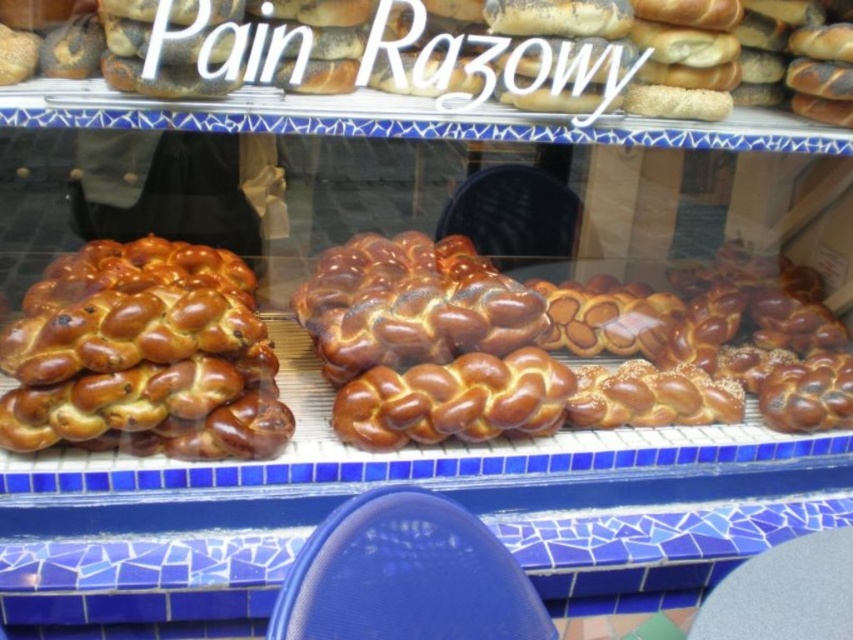
You are standing in front of the bakery display case. There is a point marked at coordinates (456, 52). What object is located at that point?

The point at coordinates (456, 52) corresponds to the golden brown braided loaf at center.